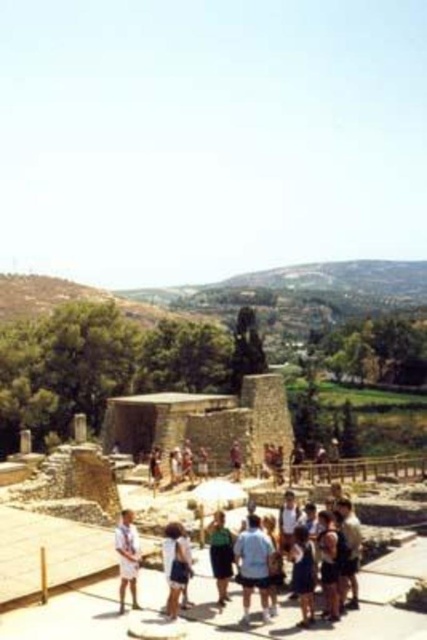
You are standing at the archaeological site and want to take a photo of the rectangular building in the center. You notice two points marked as point 1 at coordinates (254, 554) and point 2 at coordinates (169, 563). Which point should you focus on to ensure the rectangular building in the center is in sharp focus?

You should focus on point 1 at coordinates (254, 554) because it is closer to the camera and will ensure the rectangular building in the center is in sharp focus.

You are a photographer trying to capture the ancient ruins in the background. You notice a person wearing light blue denim shorts at center. Where exactly should you focus your camera to include both the ruins and the person in the frame?

To include both the ancient ruins and the person wearing light blue denim shorts at center, focus your camera at the position of the light blue denim shorts at center, which is at point [254,564]. This ensures the person is centered while the ruins remain in the background.

You are standing at the archaeological site and see a point marked at coordinates (175, 564). Based on the scene description, what object is this point located on?

The point at coordinates (175, 564) is located on the white cotton shirt at center.